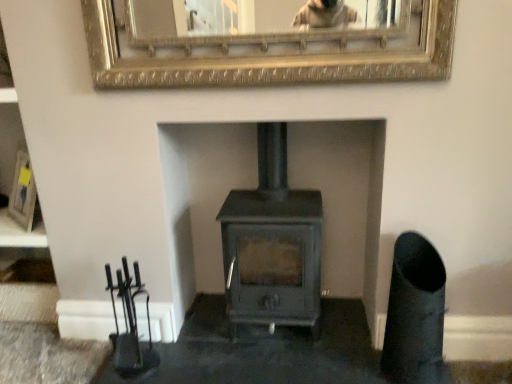
Locate an element on the screen. vacant region above matte gray wood burning stove at center (from a real-world perspective) is located at coordinates (268, 205).